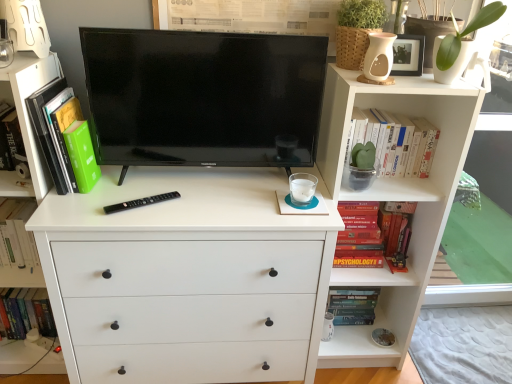
Question: From their relative heights in the image, would you say white matte chest of drawers at center is taller or shorter than hardcover book at left, the first book viewed from the left?

Choices:
 (A) short
 (B) tall

Answer: (B)

Question: In terms of width, does white matte chest of drawers at center look wider or thinner when compared to hardcover book at left, which ranks as the fifth book in right-to-left order?

Choices:
 (A) thin
 (B) wide

Answer: (B)

Question: Based on their relative distances, which object is farther from the hardcover psychology book at right, which is the 4th book from left to right?

Choices:
 (A) hardcover books at upper right, which is counted as the 5th book, starting from the left
 (B) black glossy tv at center
 (C) green matte book at left, the 4th book from the right
 (D) white matte plain at lower right
 (E) white matte chest of drawers at center

Answer: (C)

Question: Considering the real-world distances, which object is closest to the hardcover book at left, which ranks as the fifth book in right-to-left order?

Choices:
 (A) hardcover books at upper right, which is counted as the 5th book, starting from the left
 (B) green matte leaf at upper right
 (C) white matte chest of drawers at center
 (D) black glossy tv at center
 (E) green matte book at left, the 4th book from the right

Answer: (C)